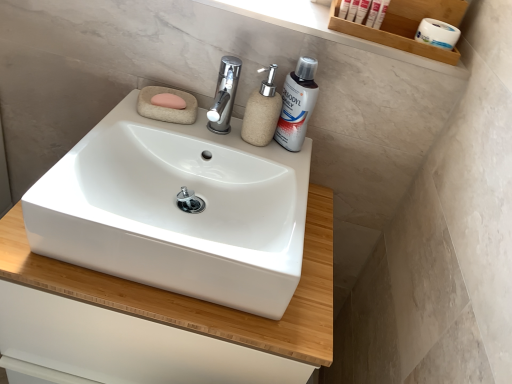
Find the location of a particular element. vacant space to the left of white plastic tubes at upper right, which is the 1th personal care in left-to-right order is located at coordinates (298, 13).